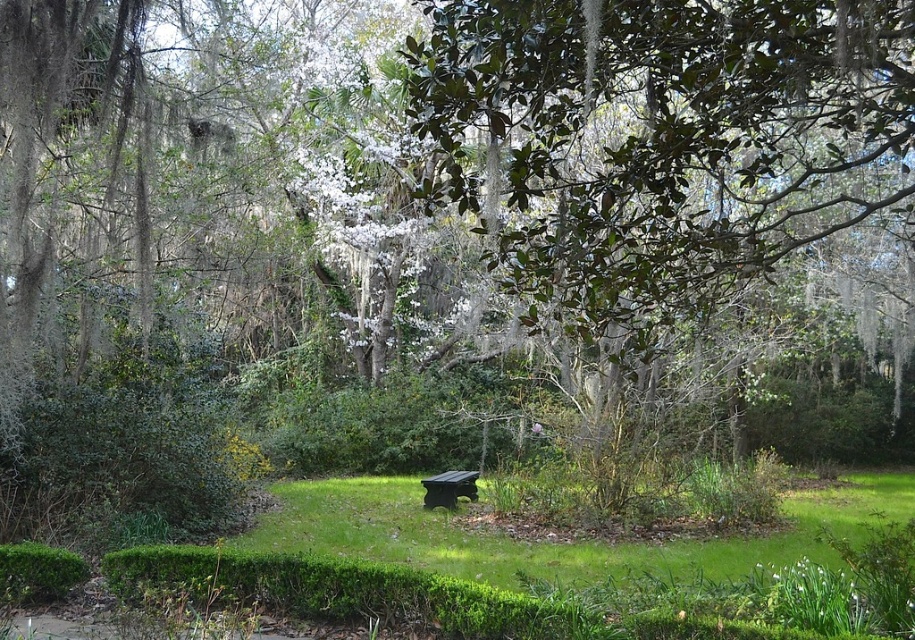
Question: Which object is closer to the camera taking this photo?

Choices:
 (A) green grass at center
 (B) green leafy hedge at center

Answer: (A)

Question: Does green grass at center have a lesser width compared to green leafy hedge at center?

Choices:
 (A) yes
 (B) no

Answer: (B)

Question: Estimate the real-world distances between objects in this image. Which object is closer to the green leafy hedge at center?

Choices:
 (A) dark brown wooden bench at center
 (B) green grass at center

Answer: (B)

Question: Is green grass at center above green leafy hedge at center?

Choices:
 (A) yes
 (B) no

Answer: (B)

Question: Does green leafy hedge at center lie behind dark brown wooden bench at center?

Choices:
 (A) no
 (B) yes

Answer: (B)

Question: Which point is farther to the camera?

Choices:
 (A) click(420, 508)
 (B) click(467, 480)

Answer: (B)